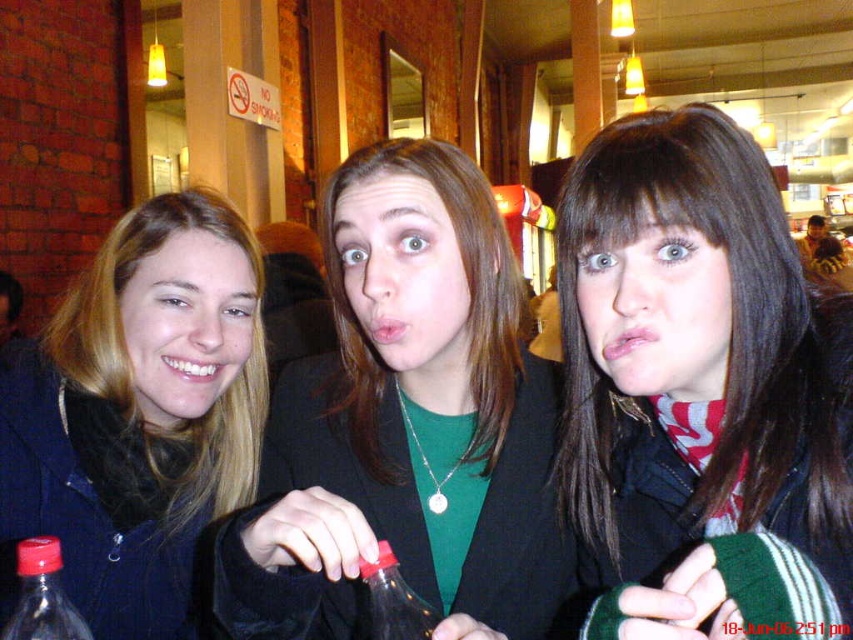
You are a photographer setting up for a group photo. You need to ensure there is enough space between the green matte shirt at center and the matte black jacket at left for a natural pose. The minimum recommended distance between subjects for a flattering shot is 9 inches. Based on the scene, will the current spacing work?

The green matte shirt at center is 8.74 inches from the matte black jacket at left. Since the minimum recommended distance is 9 inches, the current spacing is slightly too close for a flattering shot.

You are a photographer setting up for a group photo. You notice the matte black jacket at left and the translucent plastic bottle at lower left in the scene. Which object is positioned higher from the ground?

The matte black jacket at left is located above the translucent plastic bottle at lower left, so it is positioned higher from the ground.

You are standing in the room and want to reach both the point at coordinates (427, 474) and the point at coordinates (67, 548). Which point should you go to first if you want to reach the one closer to you first?

You should go to point (427, 474) first because it is closer to you than point (67, 548).